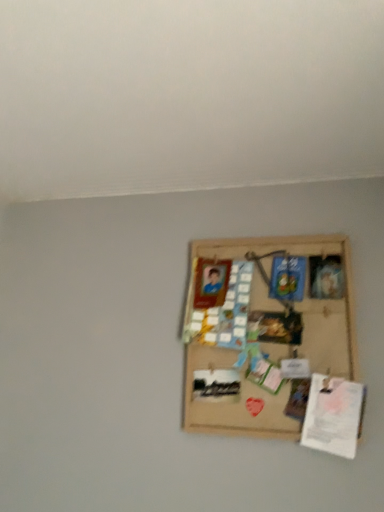
The width and height of the screenshot is (384, 512). Describe the element at coordinates (333, 415) in the screenshot. I see `white paper at lower right` at that location.

In order to face white paper at lower right, should I rotate leftwards or rightwards?

It's best to rotate right around 18.390 degrees.

What is the approximate height of white paper at lower right?

The height of white paper at lower right is 8.88 inches.

Identify the location of white paper at lower right. Image resolution: width=384 pixels, height=512 pixels. (333, 415).

In order to click on burlap board at center in this screenshot , I will do `click(268, 335)`.

Describe the element at coordinates (268, 335) in the screenshot. This screenshot has height=512, width=384. I see `burlap board at center` at that location.

Where is `white paper at lower right`? This screenshot has height=512, width=384. white paper at lower right is located at coordinates (333, 415).

Visually, is burlap board at center positioned to the left or to the right of white paper at lower right?

burlap board at center is to the left of white paper at lower right.

Based on the photo, does burlap board at center come behind white paper at lower right?

Yes, burlap board at center is further from the viewer.

Does point (193, 358) lie behind point (316, 407)?

Yes, point (193, 358) is behind point (316, 407).

From the image's perspective, which object appears higher, burlap board at center or white paper at lower right?

burlap board at center is shown above in the image.

From a real-world perspective, is burlap board at center beneath white paper at lower right?

No.

Which of these two, burlap board at center or white paper at lower right, is wider?

white paper at lower right.

Which of these two, burlap board at center or white paper at lower right, stands taller?

With more height is burlap board at center.

Based on the photo, is burlap board at center bigger or smaller than white paper at lower right?

Clearly, burlap board at center is larger in size than white paper at lower right.

Would you say burlap board at center is outside white paper at lower right?

Yes.

Is burlap board at center positioned far away from white paper at lower right?

No.

Is burlap board at center turned away from white paper at lower right?

Yes, burlap board at center is positioned with its back facing white paper at lower right.

How different are the orientations of burlap board at center and white paper at lower right in degrees?

They differ by 5.75 degrees in their facing directions.

How far apart are burlap board at center and white paper at lower right?

burlap board at center is 22.00 centimeters from white paper at lower right.

Find the location of a particular element. The height and width of the screenshot is (512, 384). plaque that appears below the burlap board at center (from the image's perspective) is located at coordinates (333, 415).

Considering the relative positions of white paper at lower right and burlap board at center in the image provided, is white paper at lower right to the left of burlap board at center from the viewer's perspective?

No, white paper at lower right is not to the left of burlap board at center.

Which object is further away from the camera, white paper at lower right or burlap board at center?

burlap board at center is further away from the camera.

Is point (353, 449) in front of point (209, 322)?

Yes.

From the image's perspective, is white paper at lower right located above burlap board at center?

Incorrect, from the image's perspective, white paper at lower right is lower than burlap board at center.

From a real-world perspective, is white paper at lower right physically below burlap board at center?

Yes, from a real-world perspective, white paper at lower right is under burlap board at center.

Does white paper at lower right have a greater width compared to burlap board at center?

Correct, the width of white paper at lower right exceeds that of burlap board at center.

Is white paper at lower right shorter than burlap board at center?

Yes, white paper at lower right is shorter than burlap board at center.

Who is bigger, white paper at lower right or burlap board at center?

burlap board at center is bigger.

Is white paper at lower right not within burlap board at center?

No, white paper at lower right is inside or overlapping with burlap board at center.

Is white paper at lower right placed right next to burlap board at center?

white paper at lower right is not next to burlap board at center, and they're not touching.

Is white paper at lower right facing towards burlap board at center?

Yes.

The height and width of the screenshot is (512, 384). Find the location of `picture frame above the white paper at lower right (from a real-world perspective)`. picture frame above the white paper at lower right (from a real-world perspective) is located at coordinates (268, 335).

The width and height of the screenshot is (384, 512). I want to click on plaque that is in front of the burlap board at center, so click(333, 415).

Locate an element on the screen. This screenshot has height=512, width=384. plaque that is on the right side of burlap board at center is located at coordinates (333, 415).